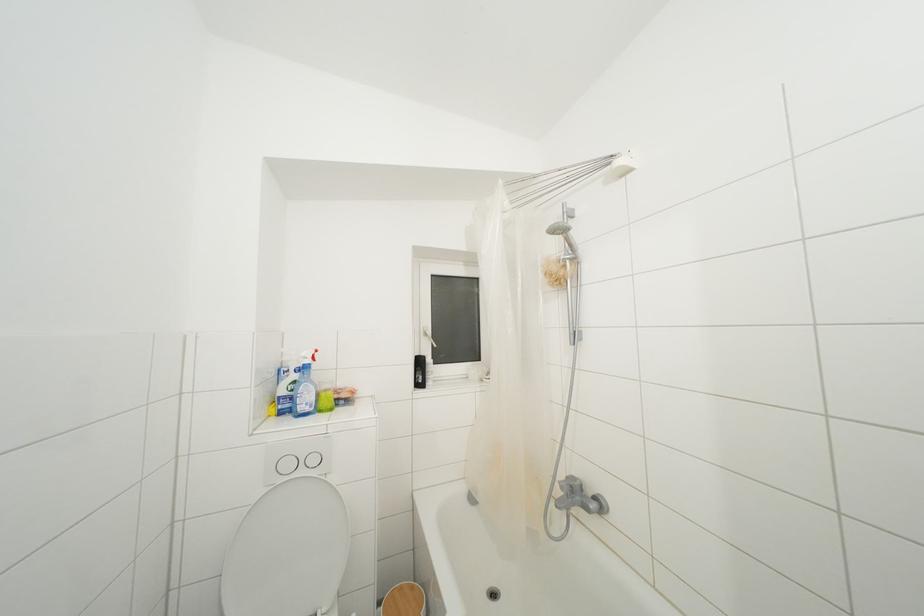
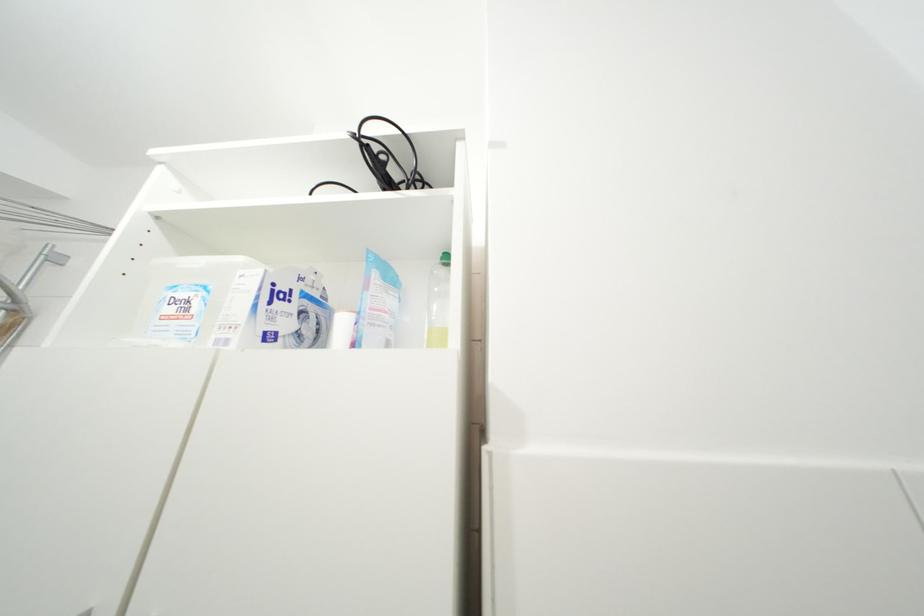
How did the camera likely rotate?

The camera rotated toward right-up.